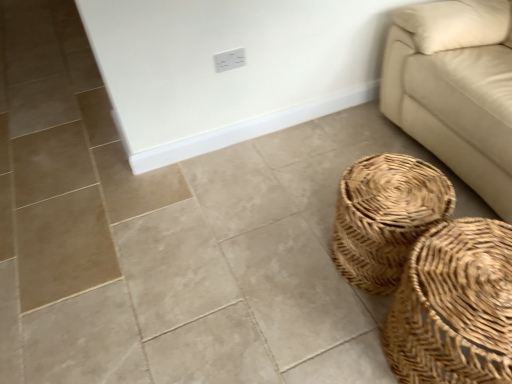
The width and height of the screenshot is (512, 384). What are the coordinates of `woven natural basket at lower right, the second basket viewed from the front` in the screenshot? It's located at (386, 217).

You are a GUI agent. You are given a task and a screenshot of the screen. Output one action in this format:
    pyautogui.click(x=<x>, y=<y>)
    Task: Click on the woven natural basket at lower right, positioned as the 2th basket in back-to-front order
    The width and height of the screenshot is (512, 384).
    Given the screenshot: What is the action you would take?
    pyautogui.click(x=454, y=307)

From a real-world perspective, who is located higher, white plastic electric outlet at upper center or woven natural basket at lower right, positioned as the 2th basket in back-to-front order?

In real-world perspective, white plastic electric outlet at upper center is above.

From the image's perspective, between white plastic electric outlet at upper center and woven natural basket at lower right, positioned as the 2th basket in back-to-front order, who is located below?

woven natural basket at lower right, positioned as the 2th basket in back-to-front order, appears lower in the image.

Does point (223, 54) come closer to viewer compared to point (468, 239)?

No.

Considering the positions of objects white plastic electric outlet at upper center and woven natural basket at lower right, positioned as the 2th basket in back-to-front order, in the image provided, who is more to the right, white plastic electric outlet at upper center or woven natural basket at lower right, positioned as the 2th basket in back-to-front order,?

Positioned to the right is woven natural basket at lower right, positioned as the 2th basket in back-to-front order.

Can you confirm if woven natural basket at lower right, the second basket viewed from the front, is shorter than white plastic electric outlet at upper center?

Incorrect, the height of woven natural basket at lower right, the second basket viewed from the front, does not fall short of that of white plastic electric outlet at upper center.

Is point (361, 206) positioned before point (238, 52)?

Yes, it is in front of point (238, 52).

Looking at the image, does woven natural basket at lower right, which appears as the first basket when viewed from the back, seem bigger or smaller compared to white plastic electric outlet at upper center?

woven natural basket at lower right, which appears as the first basket when viewed from the back, is bigger than white plastic electric outlet at upper center.

Can you tell me how much woven natural basket at lower right, the second basket viewed from the front, and white plastic electric outlet at upper center differ in facing direction?

91.6 degrees.

The height and width of the screenshot is (384, 512). I want to click on electric outlet that is above the woven natural basket at lower right, which appears as the first basket when viewed from the back (from a real-world perspective), so click(x=229, y=60).

How different are the orientations of white plastic electric outlet at upper center and woven natural basket at lower right, the second basket viewed from the front, in degrees?

The facing directions of white plastic electric outlet at upper center and woven natural basket at lower right, the second basket viewed from the front, are 91.6 degrees apart.

Which object is positioned more to the right, white plastic electric outlet at upper center or woven natural basket at lower right, the second basket viewed from the front?

woven natural basket at lower right, the second basket viewed from the front, is more to the right.

Which object is more forward, white plastic electric outlet at upper center or woven natural basket at lower right, the second basket viewed from the front?

woven natural basket at lower right, the second basket viewed from the front, is in front.

Is woven natural basket at lower right, which appears as the first basket when viewed from the back, not near woven natural basket at lower right, positioned as the 2th basket in back-to-front order?

They are positioned close to each other.

Is woven natural basket at lower right, the second basket viewed from the front, located outside woven natural basket at lower right, positioned as the 2th basket in back-to-front order?

Yes, woven natural basket at lower right, the second basket viewed from the front, is outside of woven natural basket at lower right, positioned as the 2th basket in back-to-front order.

Which of these two, woven natural basket at lower right, which appears as the first basket when viewed from the back, or woven natural basket at lower right, which is the 1th basket from front to back, is thinner?

With smaller width is woven natural basket at lower right, which appears as the first basket when viewed from the back.

This screenshot has height=384, width=512. Identify the location of basket behind the woven natural basket at lower right, which is the 1th basket from front to back. (386, 217).

Which object is wider, woven natural basket at lower right, positioned as the 2th basket in back-to-front order, or white plastic electric outlet at upper center?

With larger width is woven natural basket at lower right, positioned as the 2th basket in back-to-front order.

Does woven natural basket at lower right, positioned as the 2th basket in back-to-front order, contain white plastic electric outlet at upper center?

No, white plastic electric outlet at upper center is not a part of woven natural basket at lower right, positioned as the 2th basket in back-to-front order.

Is woven natural basket at lower right, positioned as the 2th basket in back-to-front order, to the right of white plastic electric outlet at upper center from the viewer's perspective?

Yes, woven natural basket at lower right, positioned as the 2th basket in back-to-front order, is to the right of white plastic electric outlet at upper center.

Who is shorter, woven natural basket at lower right, positioned as the 2th basket in back-to-front order, or white plastic electric outlet at upper center?

white plastic electric outlet at upper center.

Does white plastic electric outlet at upper center have a larger size compared to beige leather couch at right?

No, white plastic electric outlet at upper center is not bigger than beige leather couch at right.

Is white plastic electric outlet at upper center oriented towards beige leather couch at right?

No, white plastic electric outlet at upper center does not turn towards beige leather couch at right.

Is point (237, 63) farther from camera compared to point (509, 10)?

Yes, it is.

Is point (468, 365) positioned in front of point (481, 24)?

Yes, point (468, 365) is closer to viewer.

From the image's perspective, between woven natural basket at lower right, which is the 1th basket from front to back, and beige leather couch at right, which one is located above?

From the image's view, beige leather couch at right is above.

Who is shorter, woven natural basket at lower right, positioned as the 2th basket in back-to-front order, or beige leather couch at right?

woven natural basket at lower right, positioned as the 2th basket in back-to-front order.

Consider the image. Can you confirm if woven natural basket at lower right, which is the 1th basket from front to back, is positioned to the right of beige leather couch at right?

No, woven natural basket at lower right, which is the 1th basket from front to back, is not to the right of beige leather couch at right.

This screenshot has height=384, width=512. In order to click on electric outlet on the left of woven natural basket at lower right, which is the 1th basket from front to back in this screenshot , I will do `click(229, 60)`.

At what (x,y) coordinates should I click in order to perform the action: click on electric outlet behind the woven natural basket at lower right, which appears as the first basket when viewed from the back. Please return your answer as a coordinate pair (x, y). The width and height of the screenshot is (512, 384). Looking at the image, I should click on (229, 60).

Estimate the real-world distances between objects in this image. Which object is further from beige leather couch at right, white plastic electric outlet at upper center or woven natural basket at lower right, which is the 1th basket from front to back?

white plastic electric outlet at upper center lies further to beige leather couch at right than the other object.

From the image, which object appears to be nearer to woven natural basket at lower right, which appears as the first basket when viewed from the back, woven natural basket at lower right, which is the 1th basket from front to back, or white plastic electric outlet at upper center?

woven natural basket at lower right, which is the 1th basket from front to back, lies closer to woven natural basket at lower right, which appears as the first basket when viewed from the back, than the other object.

From the picture: Estimate the real-world distances between objects in this image. Which object is further from woven natural basket at lower right, which appears as the first basket when viewed from the back, white plastic electric outlet at upper center or beige leather couch at right?

The object further to woven natural basket at lower right, which appears as the first basket when viewed from the back, is white plastic electric outlet at upper center.

Looking at the image, which one is located further to white plastic electric outlet at upper center, beige leather couch at right or woven natural basket at lower right, positioned as the 2th basket in back-to-front order?

woven natural basket at lower right, positioned as the 2th basket in back-to-front order, lies further to white plastic electric outlet at upper center than the other object.

From the image, which object appears to be farther from beige leather couch at right, woven natural basket at lower right, which is the 1th basket from front to back, or white plastic electric outlet at upper center?

The object further to beige leather couch at right is white plastic electric outlet at upper center.

Considering their positions, is beige leather couch at right positioned closer to woven natural basket at lower right, which is the 1th basket from front to back, than white plastic electric outlet at upper center?

Based on the image, beige leather couch at right appears to be nearer to woven natural basket at lower right, which is the 1th basket from front to back.

Based on their spatial positions, is woven natural basket at lower right, which appears as the first basket when viewed from the back, or beige leather couch at right closer to woven natural basket at lower right, positioned as the 2th basket in back-to-front order?

Based on the image, woven natural basket at lower right, which appears as the first basket when viewed from the back, appears to be nearer to woven natural basket at lower right, positioned as the 2th basket in back-to-front order.

Considering their positions, is beige leather couch at right positioned closer to woven natural basket at lower right, which appears as the first basket when viewed from the back, than white plastic electric outlet at upper center?

beige leather couch at right is positioned closer to the anchor woven natural basket at lower right, which appears as the first basket when viewed from the back.

Identify the location of basket between beige leather couch at right and woven natural basket at lower right, positioned as the 2th basket in back-to-front order, in the vertical direction. (386, 217).

At what (x,y) coordinates should I click in order to perform the action: click on basket between white plastic electric outlet at upper center and woven natural basket at lower right, positioned as the 2th basket in back-to-front order, from top to bottom. Please return your answer as a coordinate pair (x, y). This screenshot has height=384, width=512. Looking at the image, I should click on (x=386, y=217).